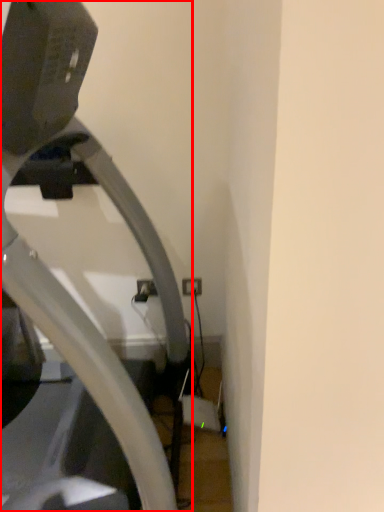
Question: Observing the image, what is the correct spatial positioning of treadmill (annotated by the red box) in reference to electric outlet?

Choices:
 (A) left
 (B) right

Answer: (A)